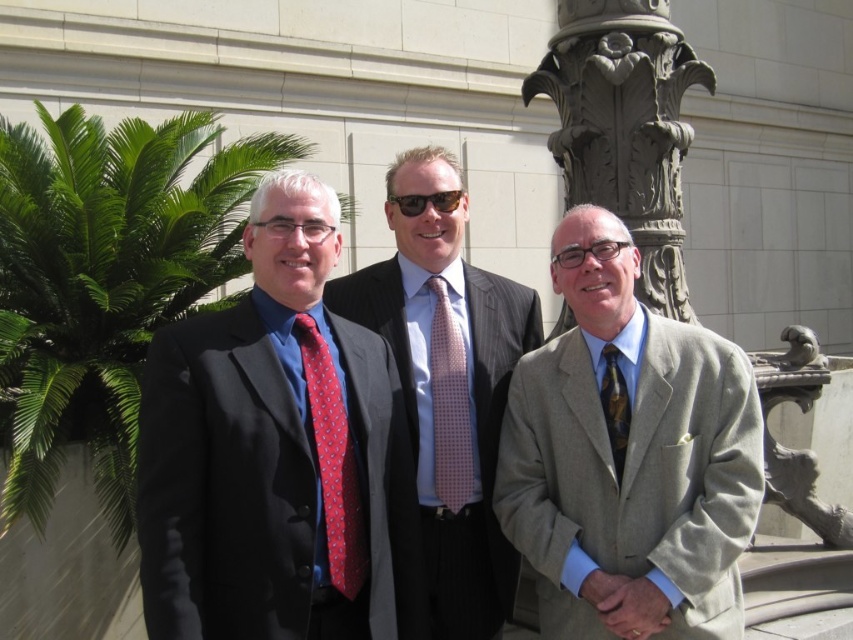
Question: Is matte black suit at left positioned behind pink dotted fabric tie at center?

Choices:
 (A) no
 (B) yes

Answer: (A)

Question: Is polished gray suit at center to the left of pink dotted fabric tie at center from the viewer's perspective?

Choices:
 (A) no
 (B) yes

Answer: (B)

Question: Which point is farther from the camera taking this photo?

Choices:
 (A) (622, 403)
 (B) (463, 365)
 (C) (567, 333)

Answer: (B)

Question: Which object is closer to the camera taking this photo?

Choices:
 (A) matte black suit at left
 (B) pink dotted fabric tie at center
 (C) green leafy palm tree at left
 (D) light beige suit at center

Answer: (A)

Question: Which point appears farthest from the camera in this image?

Choices:
 (A) (611, 332)
 (B) (613, 400)
 (C) (196, 200)
 (D) (447, 470)

Answer: (C)

Question: Is green leafy palm tree at left to the right of polished gray suit at center from the viewer's perspective?

Choices:
 (A) no
 (B) yes

Answer: (A)